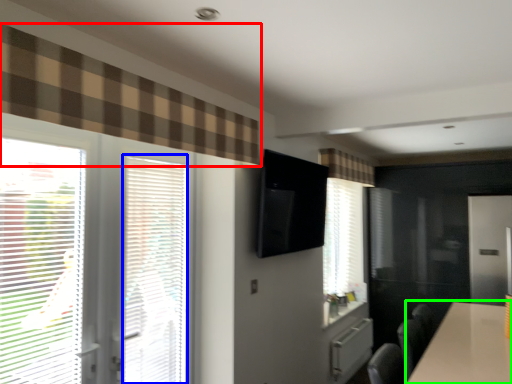
Question: Estimate the real-world distances between objects in this image. Which object is closer to curtain (highlighted by a red box), blind (highlighted by a blue box) or table (highlighted by a green box)?

Choices:
 (A) blind
 (B) table

Answer: (A)